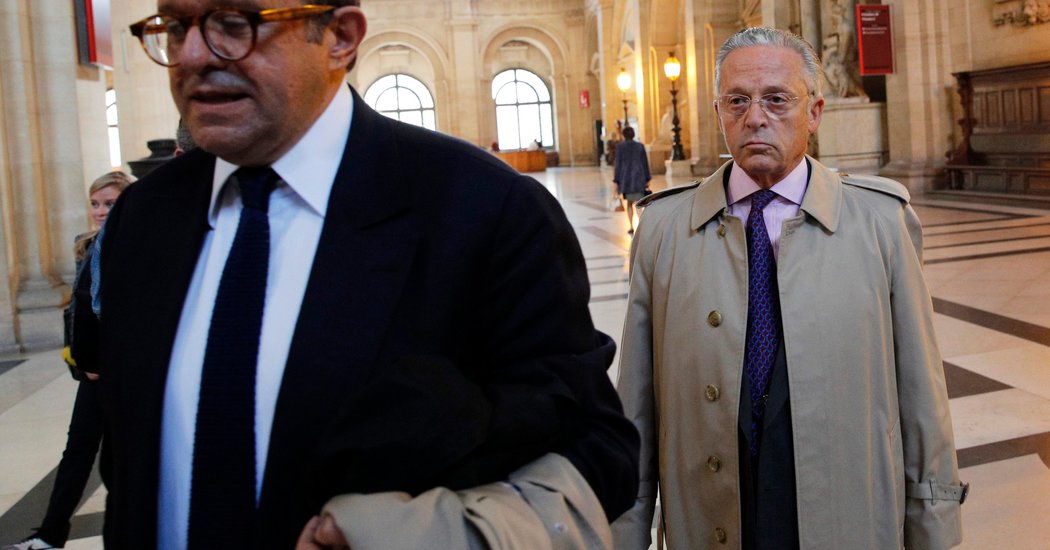
Where is `desk`? The height and width of the screenshot is (550, 1050). desk is located at coordinates (528, 158).